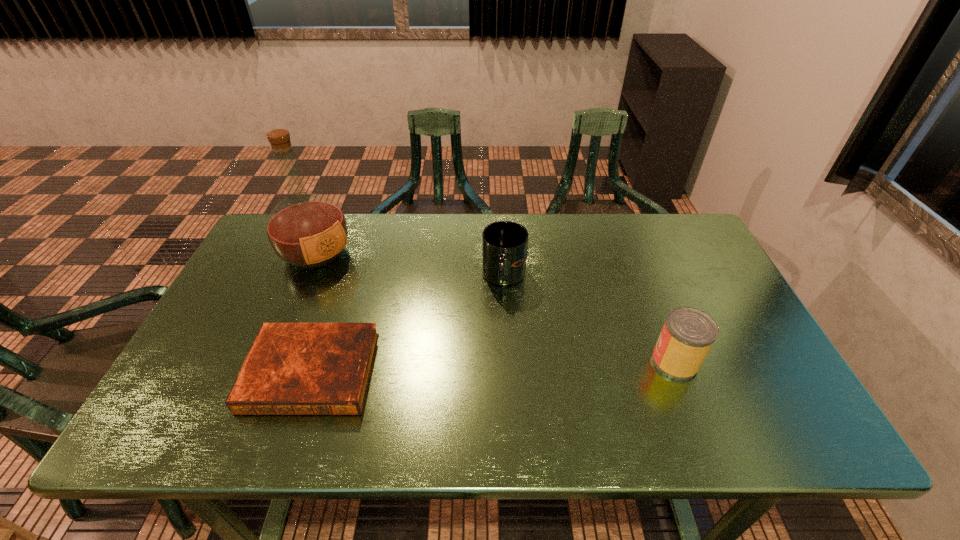
The image size is (960, 540). In the image, there is a desktop. What are the coordinates of `free space at the right edge` in the screenshot? It's located at (682, 262).

The width and height of the screenshot is (960, 540). I want to click on vacant area at the far right corner, so click(x=671, y=230).

Locate an element on the screen. free space at the near right corner is located at coordinates (726, 392).

This screenshot has height=540, width=960. I want to click on free space between the Bible and the mug, so click(x=408, y=325).

I want to click on vacant region between the Bible and the rightmost object, so click(x=493, y=367).

The image size is (960, 540). Identify the location of free space between the mug and the Bible. (408, 325).

This screenshot has height=540, width=960. In order to click on empty space between the can and the tallest object in this screenshot , I will do `click(495, 308)`.

Find the location of a particular element. The height and width of the screenshot is (540, 960). vacant space that is in between the tallest object and the shortest object is located at coordinates (314, 313).

Identify the location of unoccupied position between the Bible and the can. The width and height of the screenshot is (960, 540). (493, 367).

Locate an element on the screen. unoccupied area between the rightmost object and the liquor is located at coordinates (495, 308).